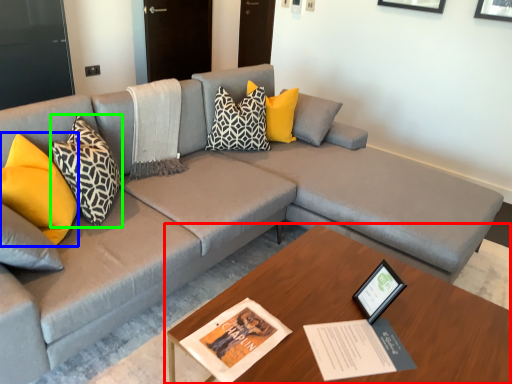
Question: Considering the real-world distances, which object is closest to table (highlighted by a red box)? pillow (highlighted by a blue box) or pillow (highlighted by a green box).

Choices:
 (A) pillow
 (B) pillow

Answer: (B)